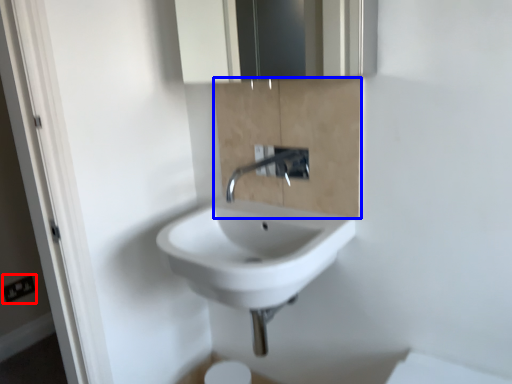
Question: Which point is closer to the camera, electric outlet (highlighted by a red box) or cabinetry (highlighted by a blue box)?

Choices:
 (A) electric outlet
 (B) cabinetry

Answer: (B)